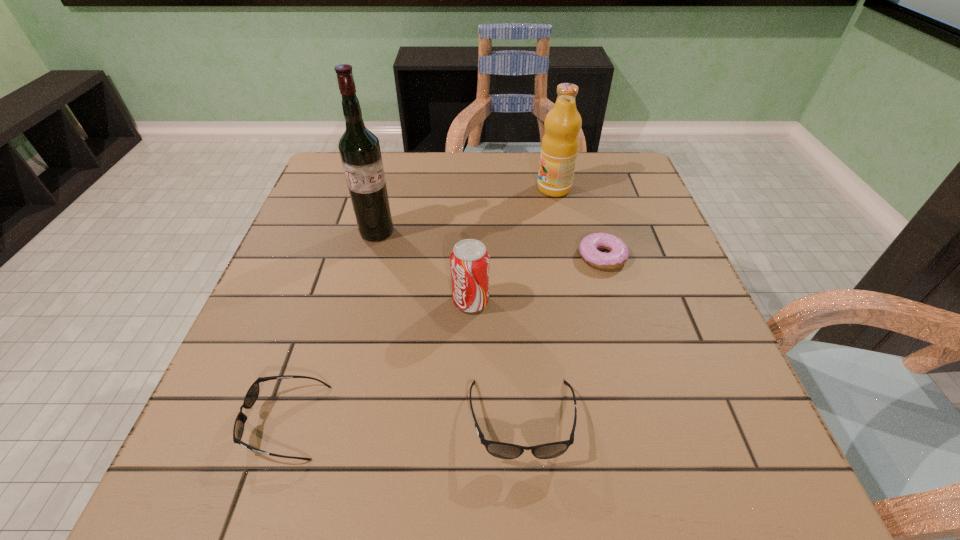
This screenshot has width=960, height=540. In order to click on vacant space that's between the left sunglasses and the right sunglasses in this screenshot , I will do `click(404, 421)`.

Find the location of a particular element. Image resolution: width=960 pixels, height=540 pixels. vacant area between the doughnut and the tallest object is located at coordinates (490, 244).

Where is `vacant space that is in between the shortest object and the right sunglasses`? vacant space that is in between the shortest object and the right sunglasses is located at coordinates (563, 338).

I want to click on free space that is in between the farthest object and the tallest object, so click(x=466, y=210).

Where is `empty space between the right sunglasses and the third tallest object`? The width and height of the screenshot is (960, 540). empty space between the right sunglasses and the third tallest object is located at coordinates (496, 361).

Identify the location of free point between the left sunglasses and the third shortest object. (404, 421).

Where is `vacant space in between the wine bottle and the farthest object`? Image resolution: width=960 pixels, height=540 pixels. vacant space in between the wine bottle and the farthest object is located at coordinates (466, 210).

Where is `the closest object to the second shortest object`? The height and width of the screenshot is (540, 960). the closest object to the second shortest object is located at coordinates point(501,450).

Identify which object is located as the second nearest to the taller sunglasses. Please provide its 2D coordinates. Your answer should be formatted as a tuple, i.e. [(x, y)], where the tuple contains the x and y coordinates of a point satisfying the conditions above.

[(252, 394)]

In order to click on blank area in the image that satisfies the following two spatial constraints: 1. on the front label of the shortest object; 2. on the right side of the farthest object in this screenshot , I will do `click(568, 256)`.